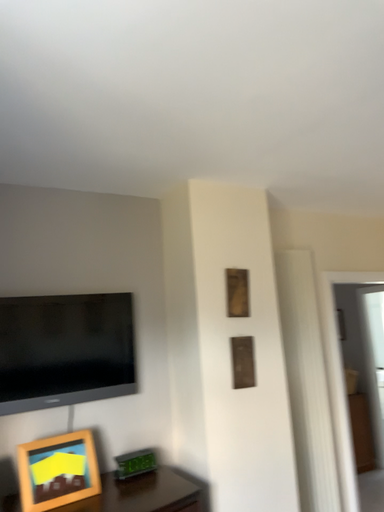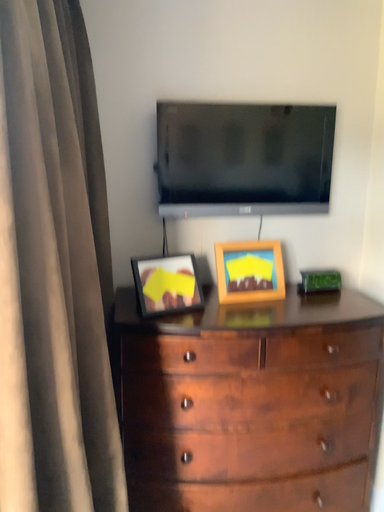
Question: Which way did the camera rotate in the video?

Choices:
 (A) rotated right
 (B) rotated left

Answer: (B)